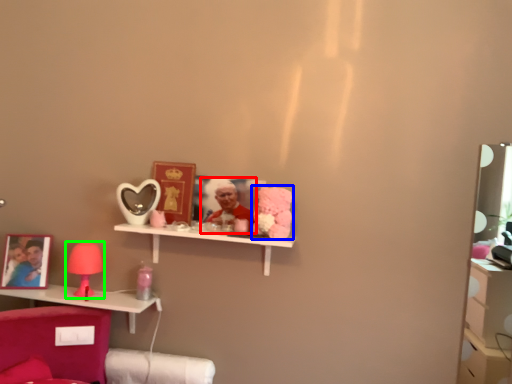
Question: Which is farther away from person (highlighted by a red box)? toy (highlighted by a blue box) or table lamp (highlighted by a green box)?

Choices:
 (A) toy
 (B) table lamp

Answer: (B)